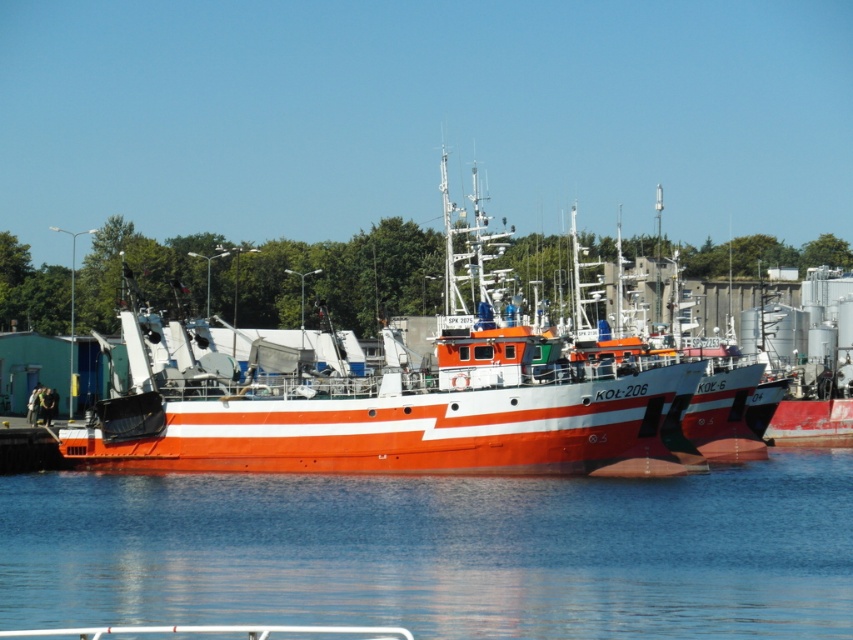
Can you confirm if transparent water at center is positioned below orange glossy boat at center?

Yes, transparent water at center is below orange glossy boat at center.

The image size is (853, 640). What do you see at coordinates (440, 552) in the screenshot?
I see `transparent water at center` at bounding box center [440, 552].

The image size is (853, 640). I want to click on transparent water at center, so click(x=440, y=552).